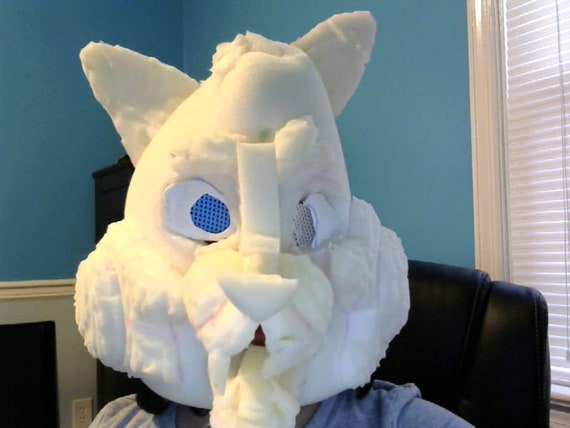
You are a GUI agent. You are given a task and a screenshot of the screen. Output one action in this format:
    pyautogui.click(x=<x>, y=<y>)
    Task: Click on the electrical outlet
    
    Given the screenshot: What is the action you would take?
    pyautogui.click(x=78, y=408)